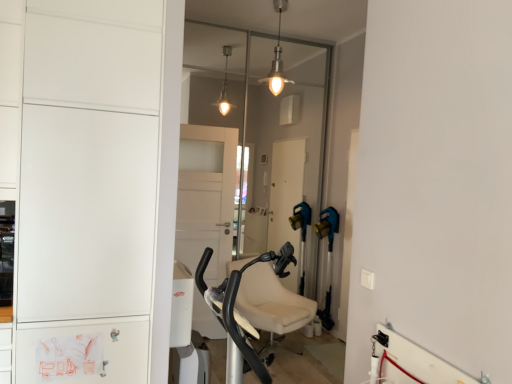
Identify the location of transparent glass door at center. (262, 119).

Image resolution: width=512 pixels, height=384 pixels. Describe the element at coordinates (277, 57) in the screenshot. I see `metallic pendant light at upper center` at that location.

What are the coordinates of `white matte cabinet at left` in the screenshot? It's located at (96, 171).

Locate an element on the screen. cabinetry below the transparent glass door at center (from the image's perspective) is located at coordinates (96, 171).

Does transparent glass door at center have a larger size compared to white matte cabinet at left?

Actually, transparent glass door at center might be smaller than white matte cabinet at left.

Is transparent glass door at center positioned beyond the bounds of white matte cabinet at left?

Yes, transparent glass door at center is outside of white matte cabinet at left.

Between metallic pendant light at upper center and transparent glass door at center, which one has smaller size?

With smaller size is metallic pendant light at upper center.

From the image's perspective, is metallic pendant light at upper center positioned above or below transparent glass door at center?

Clearly, from the image's perspective, metallic pendant light at upper center is above transparent glass door at center.

Considering the sizes of metallic pendant light at upper center and transparent glass door at center in the image, is metallic pendant light at upper center taller or shorter than transparent glass door at center?

Clearly, metallic pendant light at upper center is shorter compared to transparent glass door at center.

From a real-world perspective, who is located higher, metallic pendant light at upper center or transparent glass door at center?

In real-world perspective, metallic pendant light at upper center is above.

In terms of size, does white matte cabinet at left appear bigger or smaller than metallic pendant light at upper center?

Considering their sizes, white matte cabinet at left takes up more space than metallic pendant light at upper center.

Can we say white matte cabinet at left lies outside metallic pendant light at upper center?

Yes, white matte cabinet at left is outside of metallic pendant light at upper center.

Does white matte cabinet at left appear on the right side of metallic pendant light at upper center?

No, white matte cabinet at left is not to the right of metallic pendant light at upper center.

Can you confirm if white matte cabinet at left is wider than metallic pendant light at upper center?

Correct, the width of white matte cabinet at left exceeds that of metallic pendant light at upper center.

Is metallic pendant light at upper center far from white matte cabinet at left?

metallic pendant light at upper center is far away from white matte cabinet at left.

Would you say metallic pendant light at upper center is inside or outside white matte cabinet at left?

metallic pendant light at upper center cannot be found inside white matte cabinet at left.

From their relative heights in the image, would you say metallic pendant light at upper center is taller or shorter than white matte cabinet at left?

metallic pendant light at upper center is shorter than white matte cabinet at left.

From the image's perspective, between metallic pendant light at upper center and white matte cabinet at left, which one is located above?

metallic pendant light at upper center is shown above in the image.

From a real-world perspective, between white matte cabinet at left and transparent glass door at center, who is vertically higher?

transparent glass door at center is physically above.

Is there a large distance between white matte cabinet at left and transparent glass door at center?

Indeed, white matte cabinet at left is not near transparent glass door at center.

Which is more to the left, white matte cabinet at left or transparent glass door at center?

From the viewer's perspective, white matte cabinet at left appears more on the left side.

Find the location of a particular element. The image size is (512, 384). glass door behind the white matte cabinet at left is located at coordinates (262, 119).

Locate an element on the screen. Image resolution: width=512 pixels, height=384 pixels. glass door that appears below the metallic pendant light at upper center (from a real-world perspective) is located at coordinates (262, 119).

Considering the positions of objects transparent glass door at center and metallic pendant light at upper center in the image provided, who is in front, transparent glass door at center or metallic pendant light at upper center?

Positioned in front is metallic pendant light at upper center.

Is metallic pendant light at upper center inside transparent glass door at center?

No, metallic pendant light at upper center is located outside of transparent glass door at center.

The width and height of the screenshot is (512, 384). I want to click on glass door that is above the white matte cabinet at left (from the image's perspective), so click(x=262, y=119).

At what (x,y) coordinates should I click in order to perform the action: click on light fixture in front of the transparent glass door at center. Please return your answer as a coordinate pair (x, y). Looking at the image, I should click on (277, 57).

When comparing their distances from white matte cabinet at left, does metallic pendant light at upper center or transparent glass door at center seem further?

transparent glass door at center.

Considering their positions, is white matte cabinet at left positioned further to metallic pendant light at upper center than transparent glass door at center?

white matte cabinet at left is further to metallic pendant light at upper center.

Consider the image. From the image, which object appears to be farther from white matte cabinet at left, transparent glass door at center or metallic pendant light at upper center?

transparent glass door at center is positioned further to the anchor white matte cabinet at left.

Looking at the image, which one is located further to metallic pendant light at upper center, transparent glass door at center or white matte cabinet at left?

The object further to metallic pendant light at upper center is white matte cabinet at left.

Considering their positions, is white matte cabinet at left positioned closer to transparent glass door at center than metallic pendant light at upper center?

metallic pendant light at upper center.

Estimate the real-world distances between objects in this image. Which object is closer to transparent glass door at center, metallic pendant light at upper center or white matte cabinet at left?

Based on the image, metallic pendant light at upper center appears to be nearer to transparent glass door at center.

The width and height of the screenshot is (512, 384). Identify the location of light fixture located between white matte cabinet at left and transparent glass door at center in the depth direction. (277, 57).